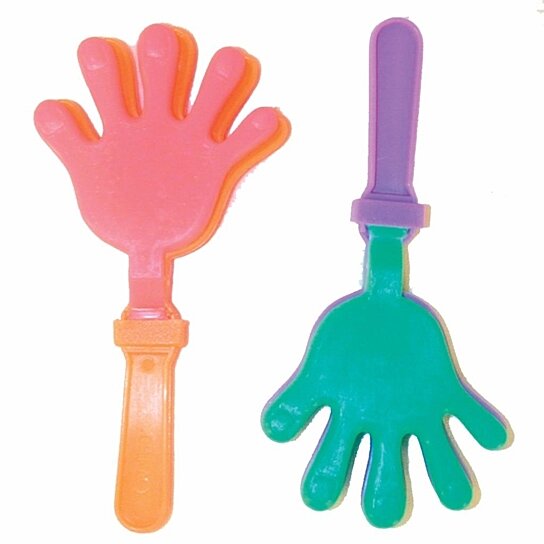
This screenshot has height=544, width=544. In order to click on handle in this screenshot , I will do `click(146, 441)`, `click(383, 116)`.